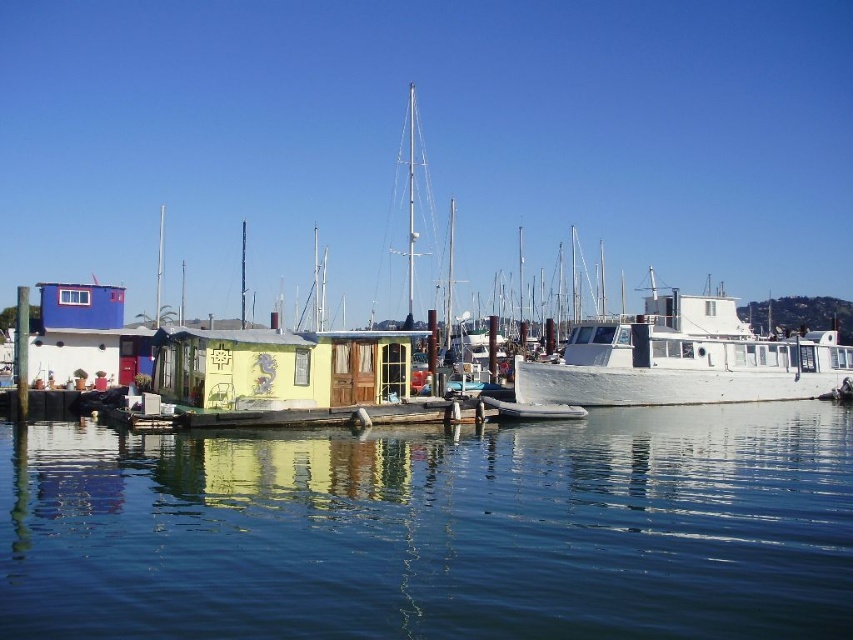
Question: Is transparent blue water at center below white matte boat at center?

Choices:
 (A) yes
 (B) no

Answer: (A)

Question: Is transparent blue water at center in front of white matte boat at center?

Choices:
 (A) yes
 (B) no

Answer: (A)

Question: Which point appears farthest from the camera in this image?

Choices:
 (A) (408, 557)
 (B) (618, 372)

Answer: (B)

Question: Is transparent blue water at center closer to camera compared to white matte boat at center?

Choices:
 (A) no
 (B) yes

Answer: (B)

Question: Which of the following is the closest to the observer?

Choices:
 (A) (181, 468)
 (B) (846, 360)

Answer: (A)